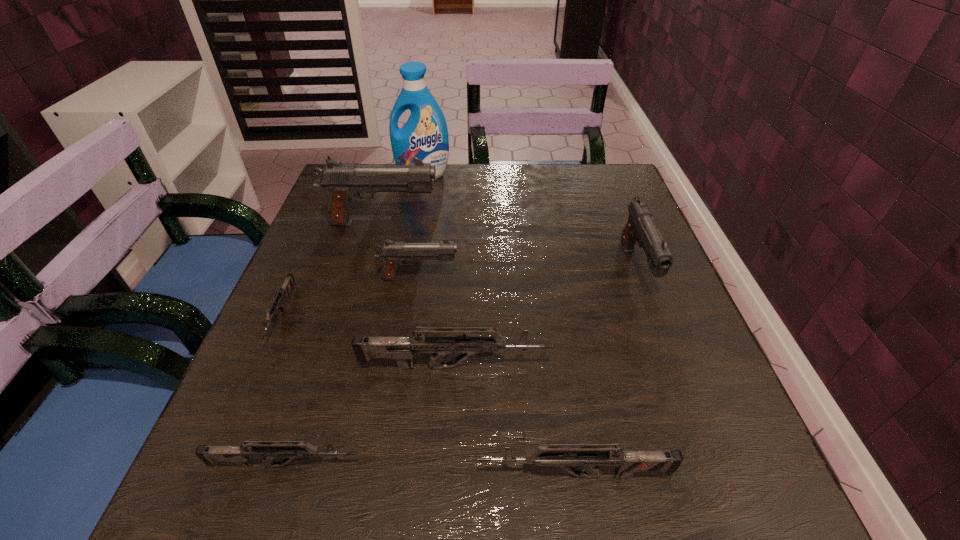
This screenshot has height=540, width=960. Identify the location of the second closest gray gun relative to the fifth tallest gun. (392, 253).

Select which gray gun appears as the second closest to the tallest object. Please provide its 2D coordinates. Your answer should be formatted as a tuple, i.e. [(x, y)], where the tuple contains the x and y coordinates of a point satisfying the conditions above.

[(392, 253)]

The image size is (960, 540). Find the location of `grey gun that can be found as the closest to the sixth farthest object`. grey gun that can be found as the closest to the sixth farthest object is located at coordinates (268, 450).

Identify which grey gun is located as the fourth nearest to the detergent. Please provide its 2D coordinates. Your answer should be formatted as a tuple, i.e. [(x, y)], where the tuple contains the x and y coordinates of a point satisfying the conditions above.

[(564, 457)]

At what (x,y) coordinates should I click in order to perform the action: click on vacant position in the image that satisfies the following two spatial constraints: 1. on the front-facing side of the tallest object; 2. aimed along the barrel of the third biggest grey gun. Please return your answer as a coordinate pair (x, y). The height and width of the screenshot is (540, 960). Looking at the image, I should click on (370, 465).

Find the location of a particular element. This screenshot has height=540, width=960. vacant position in the image that satisfies the following two spatial constraints: 1. in the direction the second farthest object is aimed; 2. aimed along the barrel of the farthest grey gun is located at coordinates (x=357, y=315).